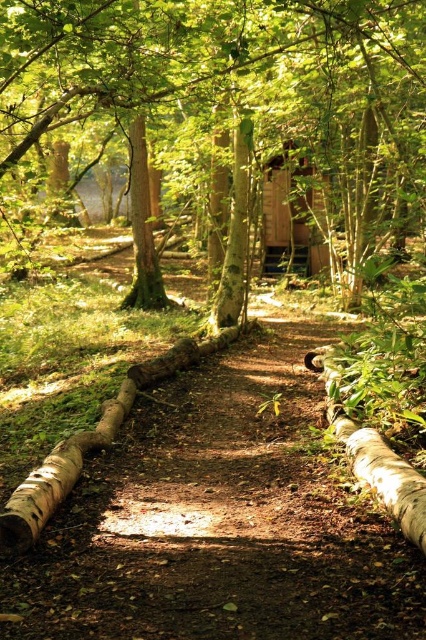
Question: Which point is farther to the camera?

Choices:
 (A) (267, 196)
 (B) (147, 273)

Answer: (A)

Question: Which object is the farthest from the green mossy tree at center?

Choices:
 (A) smooth brown tree trunk at center
 (B) green rough bark tree trunk at center
 (C) brown dirt path at center

Answer: (C)

Question: Is green mossy tree at center thinner than smooth brown tree trunk at center?

Choices:
 (A) yes
 (B) no

Answer: (B)

Question: Which point is farther to the camera?

Choices:
 (A) (319, 269)
 (B) (328, 74)

Answer: (A)

Question: Observing the image, what is the correct spatial positioning of green mossy tree at center in reference to wooden cabin at center?

Choices:
 (A) right
 (B) left

Answer: (B)

Question: Is wooden cabin at center behind smooth brown tree trunk at center?

Choices:
 (A) no
 (B) yes

Answer: (B)